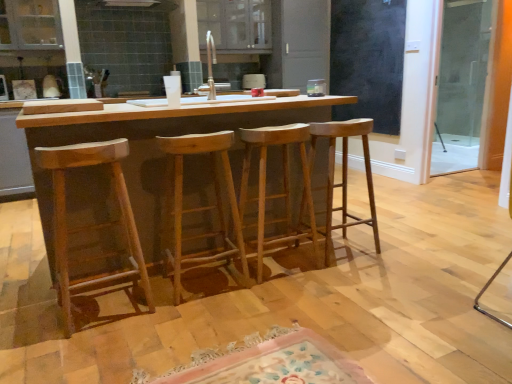
Question: From the image's perspective, is floral rug at lower center located above natural wood stool at center, placed as the 2th stool when sorted from left to right?

Choices:
 (A) no
 (B) yes

Answer: (A)

Question: Is floral rug at lower center bigger than natural wood stool at center, which is the third stool from right to left?

Choices:
 (A) no
 (B) yes

Answer: (A)

Question: Is floral rug at lower center positioned beyond the bounds of natural wood stool at center, which is the third stool from right to left?

Choices:
 (A) no
 (B) yes

Answer: (B)

Question: From a real-world perspective, is floral rug at lower center physically below natural wood stool at center, which is the third stool from right to left?

Choices:
 (A) yes
 (B) no

Answer: (A)

Question: From the image's perspective, is floral rug at lower center below natural wood stool at center, which is the third stool from right to left?

Choices:
 (A) yes
 (B) no

Answer: (A)

Question: Can you confirm if floral rug at lower center is wider than natural wood stool at center, placed as the 2th stool when sorted from left to right?

Choices:
 (A) no
 (B) yes

Answer: (B)

Question: Is natural wood stool at center, arranged as the third stool when viewed from the left, at the left side of white ceramic sink at center?

Choices:
 (A) yes
 (B) no

Answer: (B)

Question: From a real-world perspective, is natural wood stool at center, arranged as the third stool when viewed from the left, located beneath white ceramic sink at center?

Choices:
 (A) no
 (B) yes

Answer: (B)

Question: Can you confirm if natural wood stool at center, arranged as the third stool when viewed from the left, is wider than white ceramic sink at center?

Choices:
 (A) yes
 (B) no

Answer: (B)

Question: Would you say natural wood stool at center, which is the second stool from right to left, is outside white ceramic sink at center?

Choices:
 (A) yes
 (B) no

Answer: (A)

Question: Does natural wood stool at center, which is the second stool from right to left, have a lesser height compared to white ceramic sink at center?

Choices:
 (A) yes
 (B) no

Answer: (B)

Question: From a real-world perspective, is natural wood stool at center, arranged as the third stool when viewed from the left, on white ceramic sink at center?

Choices:
 (A) no
 (B) yes

Answer: (A)

Question: From the image's perspective, is natural wood table at center below white ceramic sink at center?

Choices:
 (A) no
 (B) yes

Answer: (B)